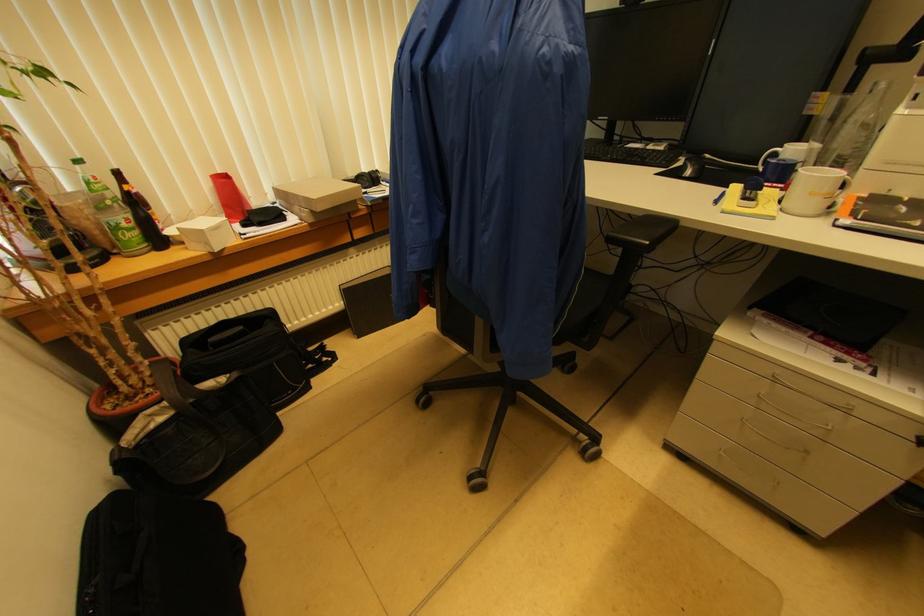
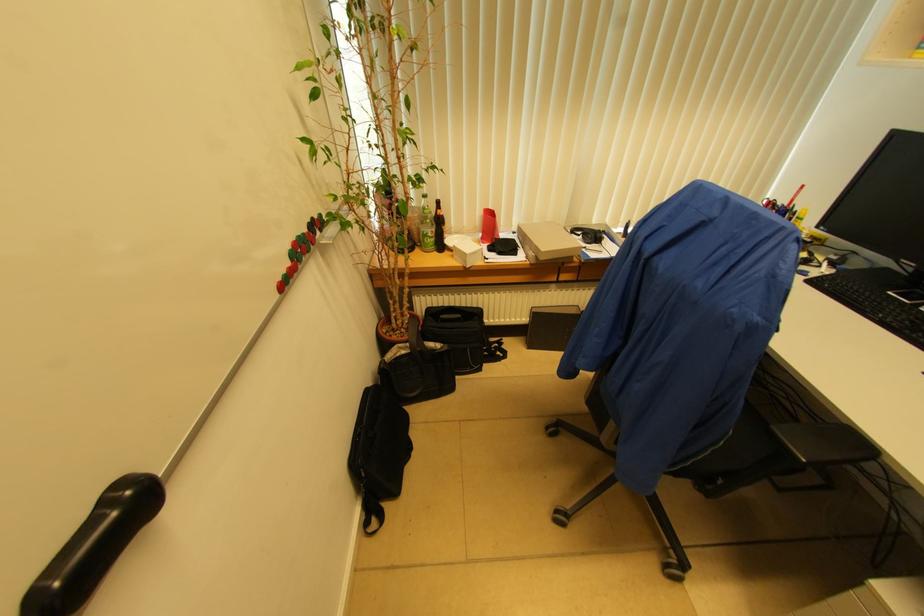
In the second image, find the point that corresponds to point 237,554 in the first image.

(409, 451)